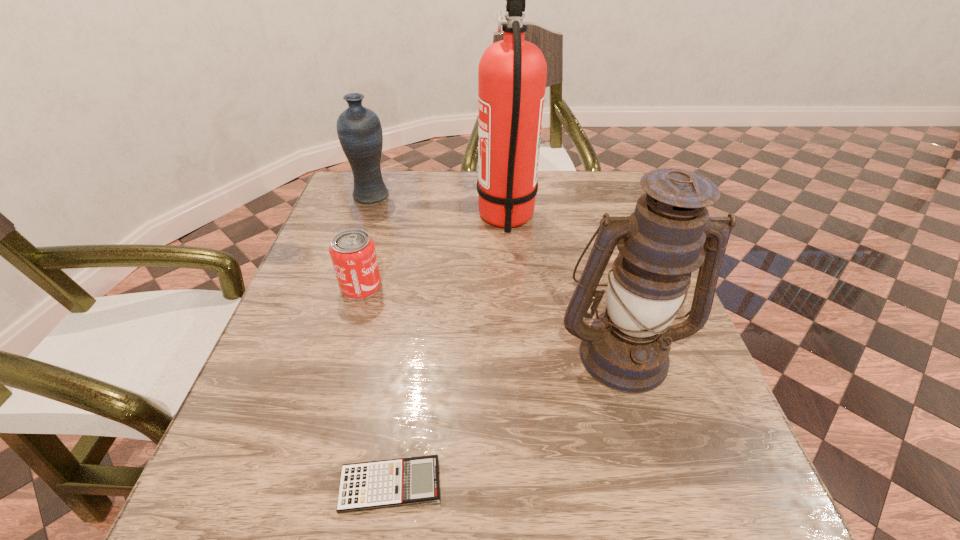
Where is `fire extinguisher`? fire extinguisher is located at coordinates (512, 73).

Locate an element on the screen. oil lamp is located at coordinates (626, 348).

Identify the location of the second tallest object. This screenshot has width=960, height=540. (626, 348).

This screenshot has width=960, height=540. In order to click on the third tallest object in this screenshot , I will do `click(359, 130)`.

The width and height of the screenshot is (960, 540). Find the location of `the fourth tallest object`. the fourth tallest object is located at coordinates tap(352, 251).

Find the location of `the third farthest object`. the third farthest object is located at coordinates (352, 251).

Find the location of `the shortest object`. the shortest object is located at coordinates (382, 484).

Where is `the nearest object`? The image size is (960, 540). the nearest object is located at coordinates (382, 484).

Find the location of a particular element. free space located on the handle side of the tallest object is located at coordinates (379, 219).

The height and width of the screenshot is (540, 960). In order to click on free space located on the handle side of the tallest object in this screenshot , I will do `click(387, 219)`.